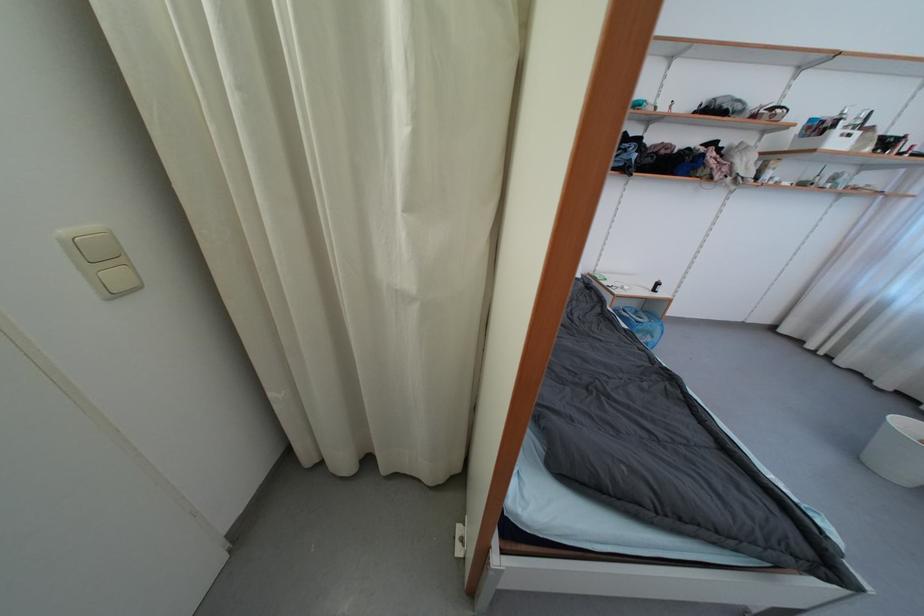
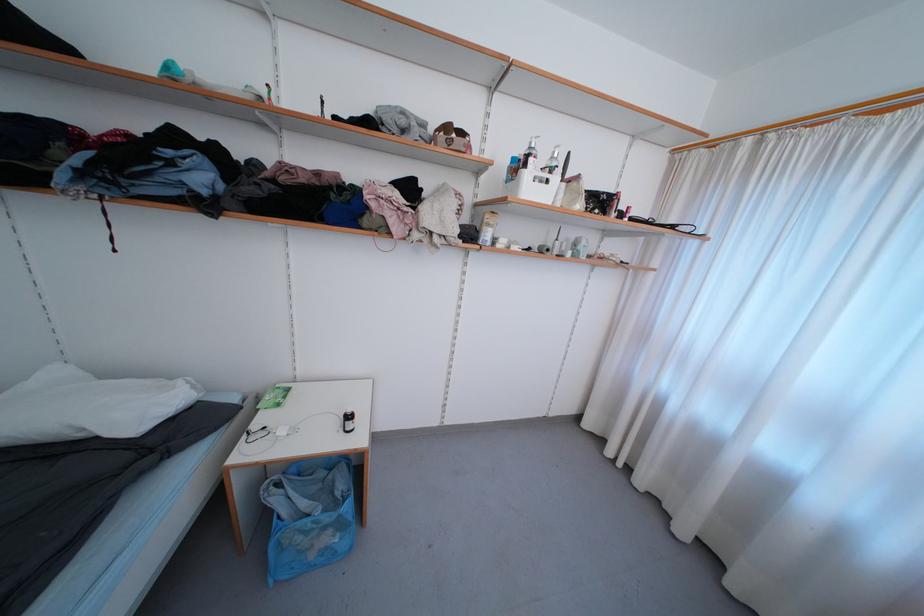
Find the pixel in the second image that matches (x=839, y=129) in the first image.

(529, 168)